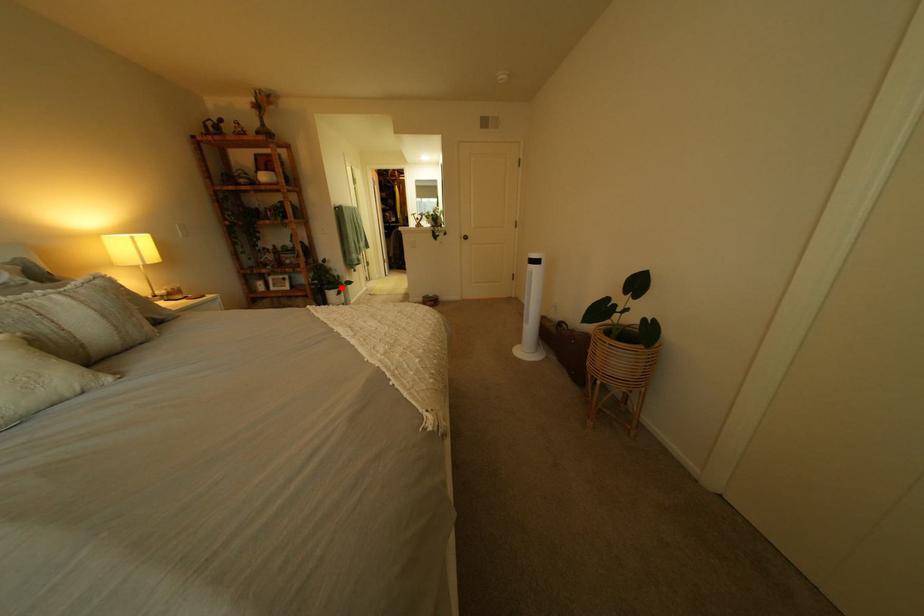
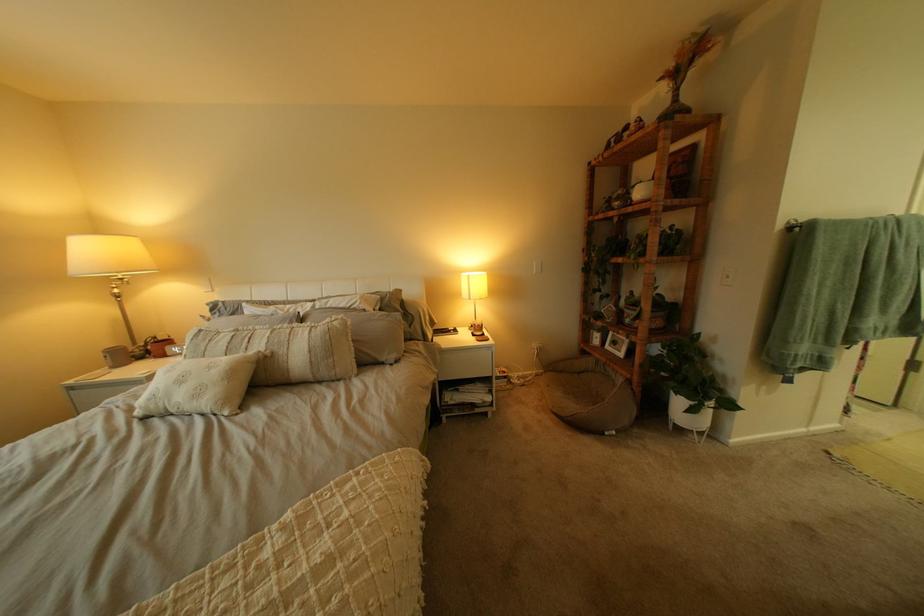
Find the pixel in the second image that matches the highlighted location in the first image.

(687, 385)